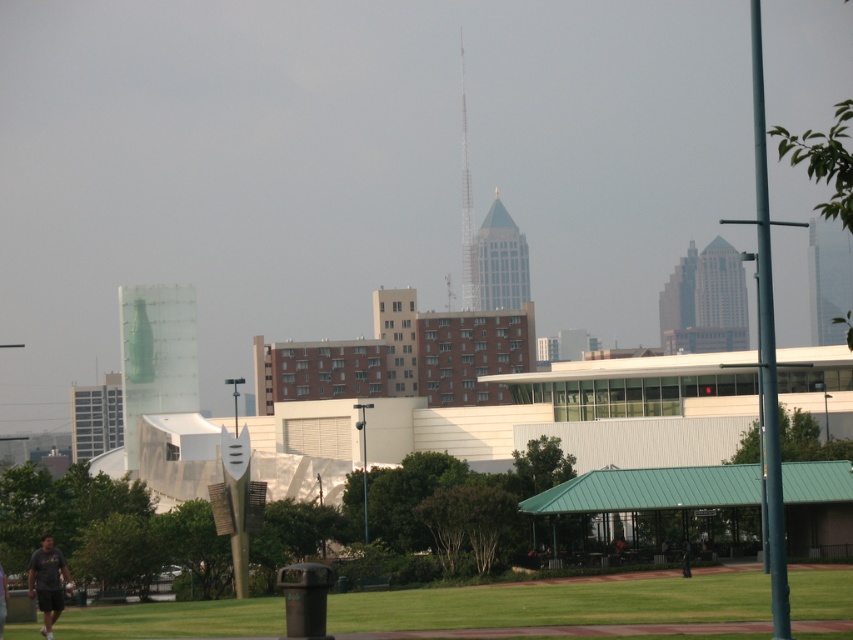
In the scene shown: Who is higher up, dark gray t-shirt at lower left or dark gray shirt at lower center?

Positioned higher is dark gray t-shirt at lower left.

Can you confirm if dark gray t-shirt at lower left is positioned to the left of dark gray shirt at lower center?

Correct, you'll find dark gray t-shirt at lower left to the left of dark gray shirt at lower center.

Is point (65, 576) closer to camera compared to point (689, 548)?

Yes, point (65, 576) is in front of point (689, 548).

Where is `dark gray t-shirt at lower left`? dark gray t-shirt at lower left is located at coordinates (47, 580).